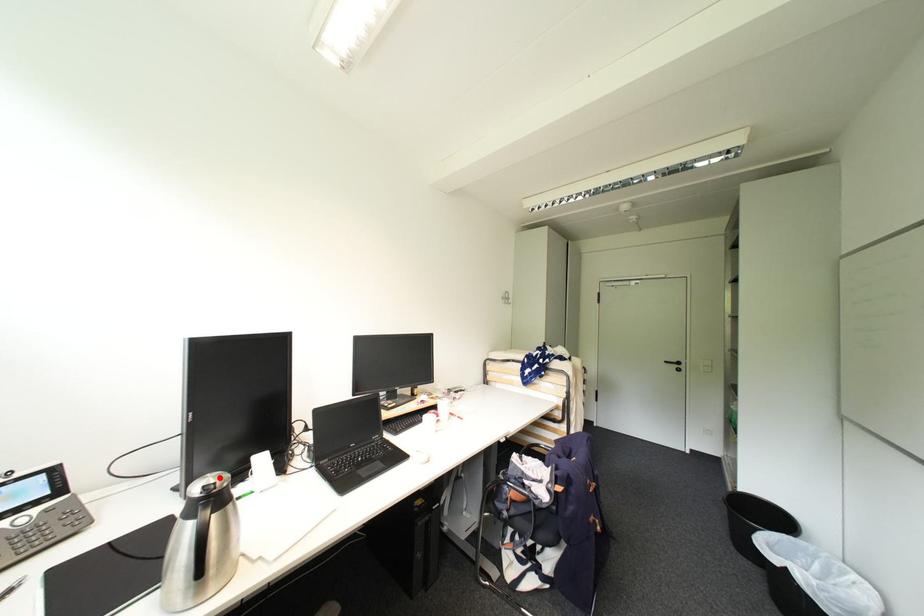
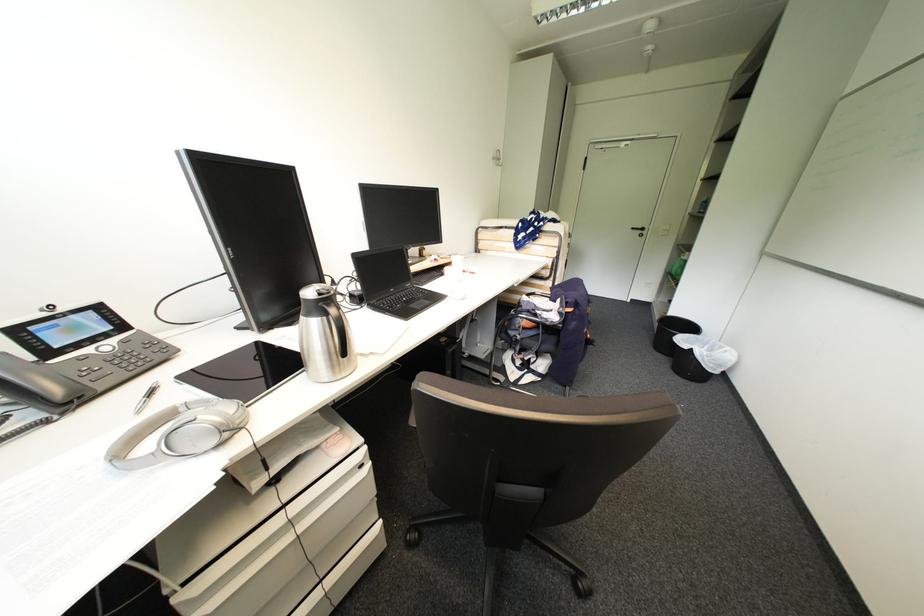
The point at the highlighted location is marked in the first image. Where is the corresponding point in the second image?

(324, 286)